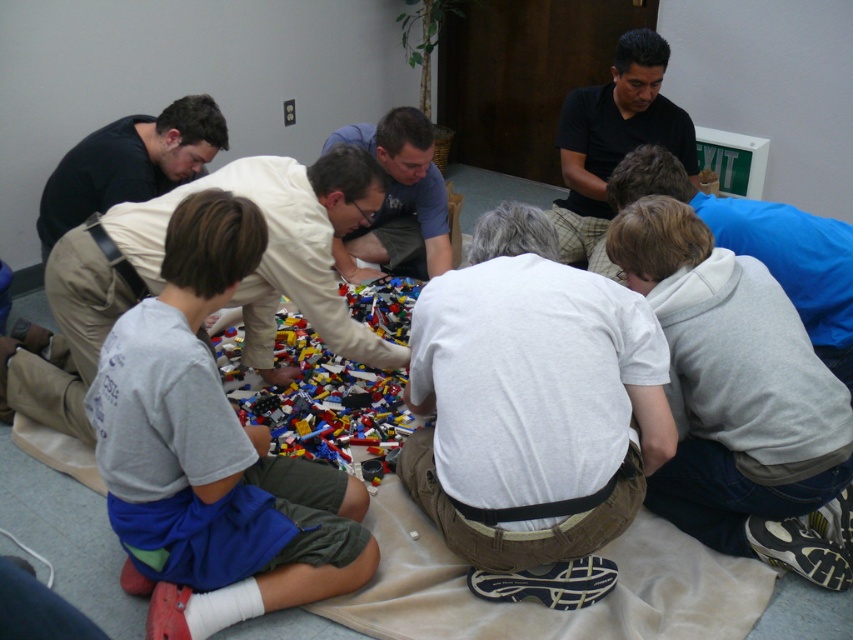
You are a photographer trying to capture a candid shot of the two people at the center of the LEGO building activity. The subjects are wearing a gray cotton shirt at center and a matte blue shirt at center. Since you want to focus on the person closer to you, which one should you aim your camera at?

The gray cotton shirt at center is closer to the viewer than the matte blue shirt at center, so you should aim your camera at the gray cotton shirt at center to focus on the person closer to you.

You are standing in the room where the LEGO building event is happening. You need to take a photo of the gray cotton shirt at center without moving it. You have a camera that has a minimum focusing distance of 1.5 meters. Can you take the photo from where you are standing?

The gray cotton shirt at center and the camera are 1.54 meters apart. Since the minimum focusing distance of the camera is 1.5 meters, the distance is sufficient. Therefore, you can take the photo from your current position.

You are standing at the entrance of the room and want to locate the white cotton shirt at center. According to the coordinates provided, in which direction should you look relative to your position?

The white cotton shirt at center is located at coordinates point (531, 401), which is to the center of the room. Since you are at the entrance, you should look towards the center of the room to find it.